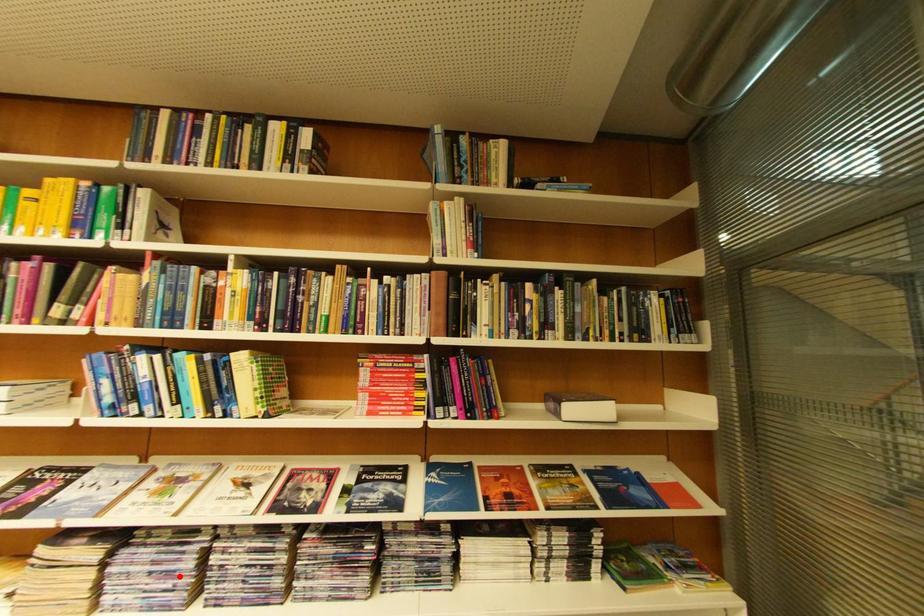
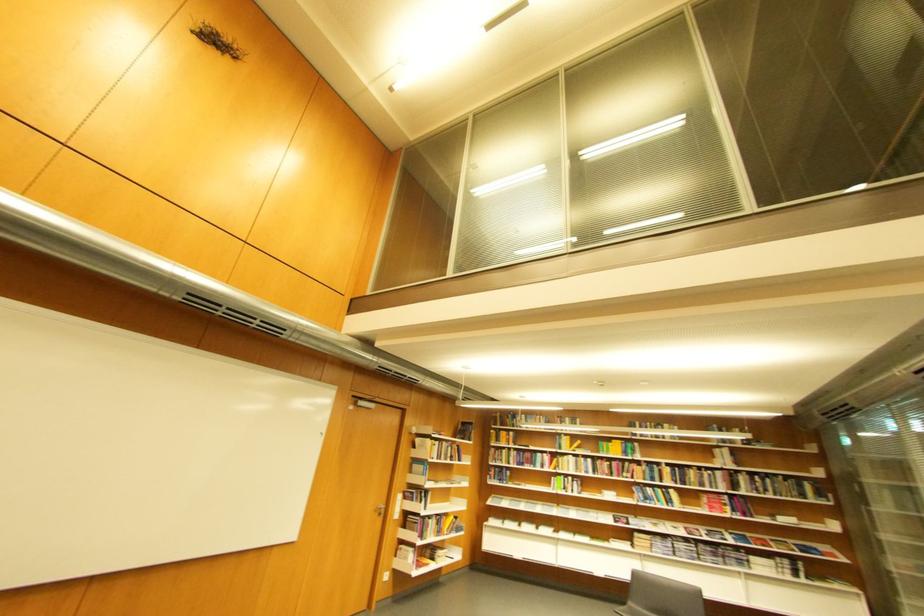
Locate, in the second image, the point that corresponds to the highlighted location in the first image.

(677, 549)